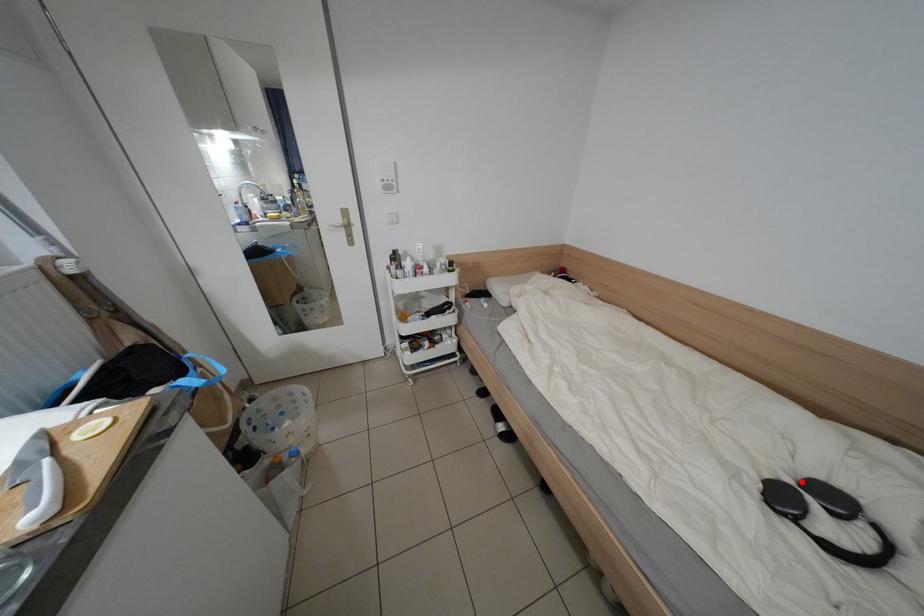
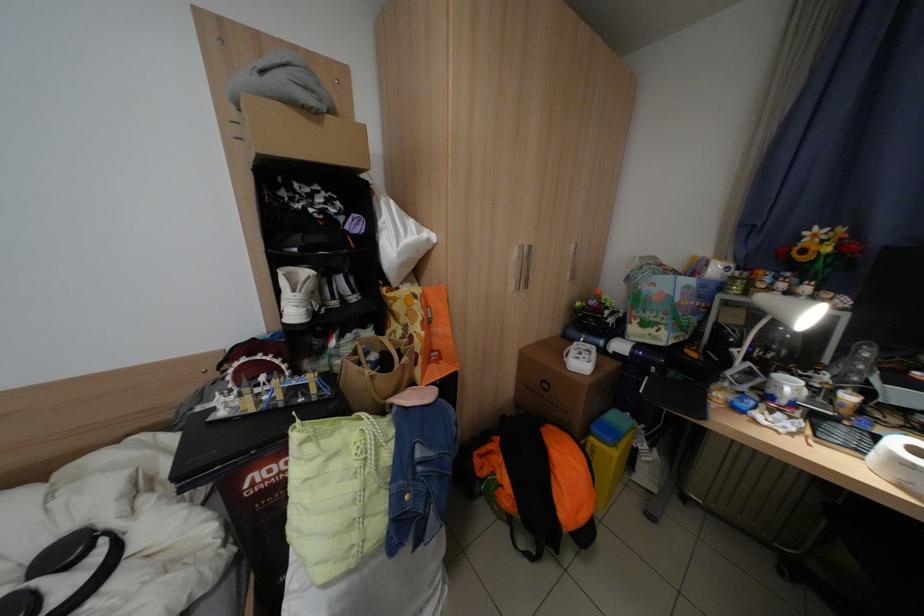
Question: I am providing you with two images of the same scene from different viewpoints. A red point is shown in image1. For the corresponding object point in image2, is it positioned nearer or farther from the camera?

Choices:
 (A) Nearer
 (B) Farther

Answer: (A)